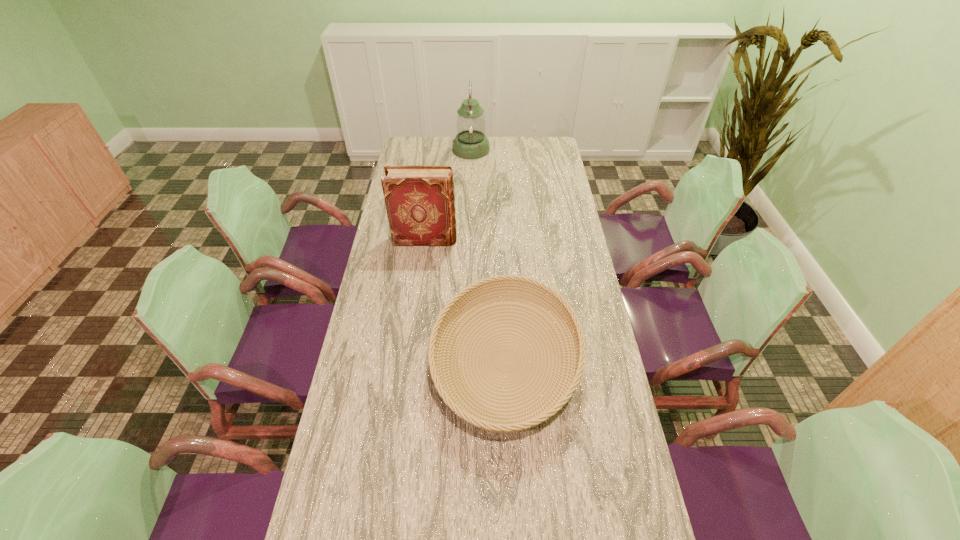
This screenshot has height=540, width=960. Identify the location of vacant area at the far edge of the desktop. (512, 143).

Locate an element on the screen. The image size is (960, 540). vacant area at the left edge of the desktop is located at coordinates (386, 411).

Identify the location of free spot at the right edge of the desktop. This screenshot has height=540, width=960. (560, 248).

This screenshot has width=960, height=540. Identify the location of free space at the far left corner. (428, 151).

Locate an element on the screen. The width and height of the screenshot is (960, 540). empty location between the second nearest object and the basket is located at coordinates (466, 300).

This screenshot has height=540, width=960. I want to click on free space between the basket and the hardback book, so click(466, 300).

In order to click on free space between the shortest object and the farthest object in this screenshot , I will do `click(489, 255)`.

Identify the location of the closest object to the nearest object. (419, 199).

Point out which object is positioned as the second nearest to the lantern. Please provide its 2D coordinates. Your answer should be formatted as a tuple, i.e. [(x, y)], where the tuple contains the x and y coordinates of a point satisfying the conditions above.

[(438, 370)]

Locate an element on the screen. vacant area that satisfies the following two spatial constraints: 1. on the spine side of the second nearest object; 2. on the back side of the nearest object is located at coordinates (410, 361).